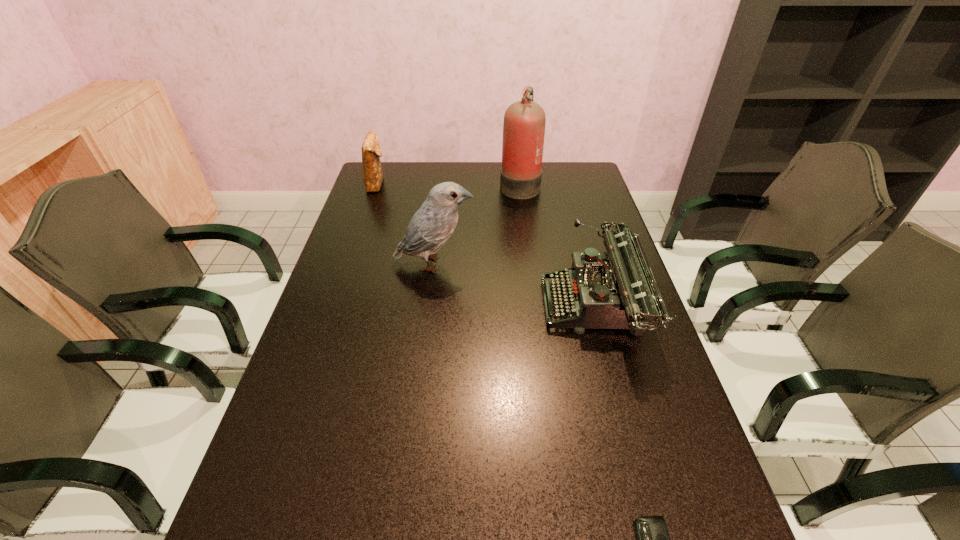
Find the location of a particular element. This screenshot has width=960, height=540. free space located 0.190m on the keyboard of the typewriter is located at coordinates click(x=472, y=307).

This screenshot has height=540, width=960. In order to click on free point located on the keyboard of the typewriter in this screenshot , I will do `click(502, 307)`.

Identify the location of free spot located on the keyboard of the typewriter. (394, 307).

Find the location of a particular element. The width and height of the screenshot is (960, 540). fire extinguisher that is at the far edge is located at coordinates (524, 123).

Find the location of a particular element. clutch bag that is at the far edge is located at coordinates (371, 150).

At what (x,y) coordinates should I click in order to perform the action: click on object that is positioned at the left edge. Please return your answer as a coordinate pair (x, y). Looking at the image, I should click on (371, 150).

This screenshot has width=960, height=540. In order to click on object that is at the right edge in this screenshot , I will do `click(620, 293)`.

Locate an element on the screen. object situated at the far left corner is located at coordinates (371, 150).

Identify the location of vacant space at the far edge of the desktop. Image resolution: width=960 pixels, height=540 pixels. (483, 161).

Identify the location of vacant space at the left edge. The height and width of the screenshot is (540, 960). (x=348, y=312).